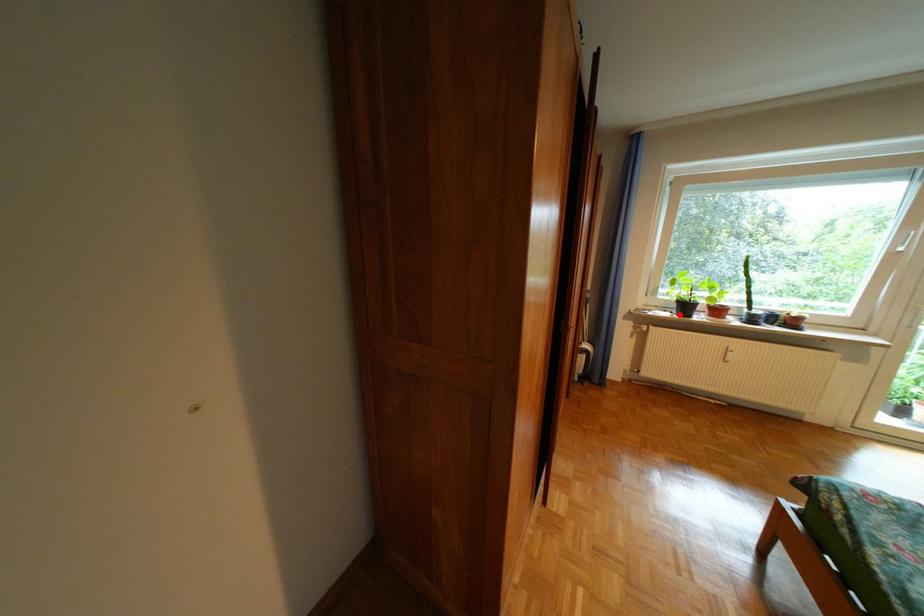
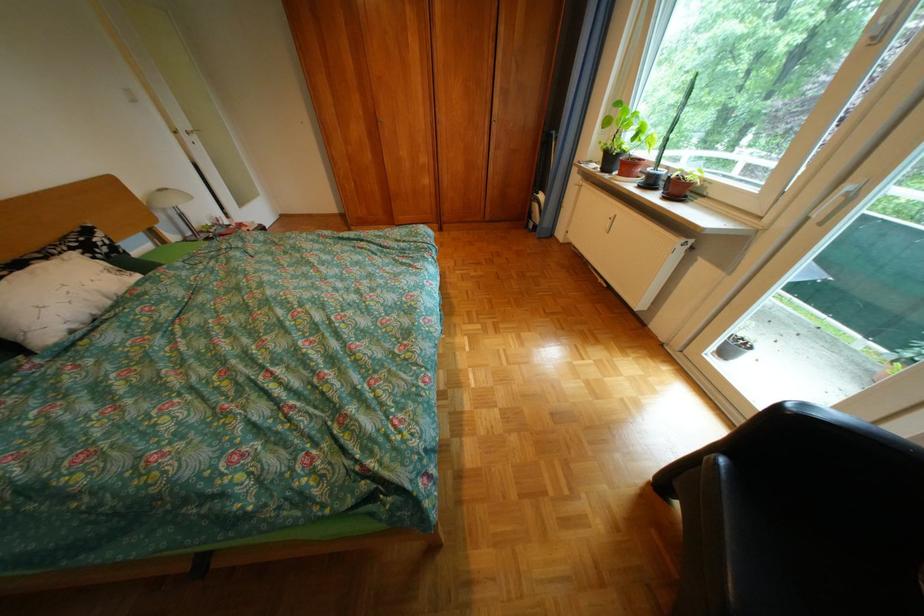
The point at the highlighted location is marked in the first image. Where is the corresponding point in the second image?

(610, 168)